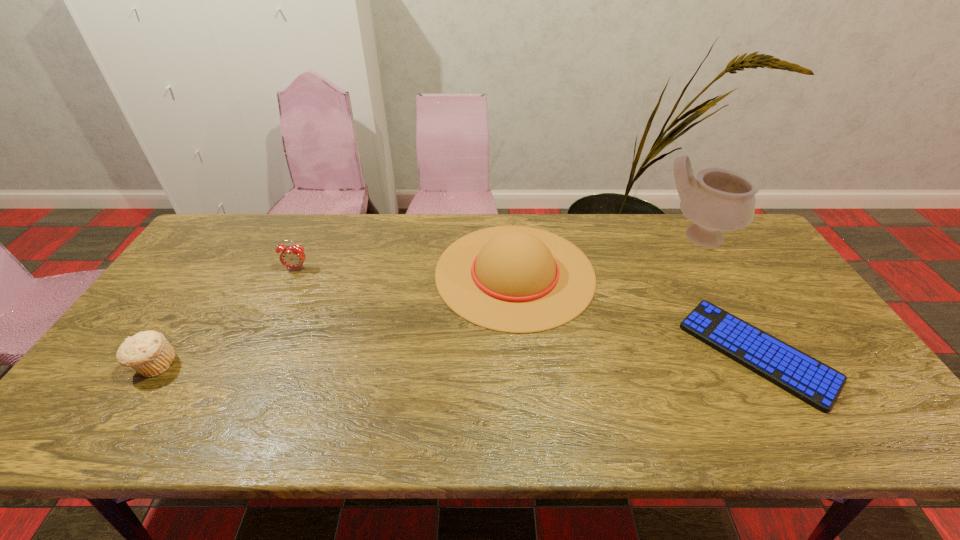
Where is `free space at the left edge of the desktop`? This screenshot has width=960, height=540. free space at the left edge of the desktop is located at coordinates (217, 282).

Find the location of a particular element. This screenshot has height=540, width=960. free spot at the right edge of the desktop is located at coordinates (748, 300).

In the image, there is a desktop. Identify the location of blank space at the far right corner. The width and height of the screenshot is (960, 540). (738, 254).

Locate an element on the screen. This screenshot has width=960, height=540. free space at the near right corner of the desktop is located at coordinates (891, 431).

Locate an element on the screen. vacant area that lies between the leftmost object and the fourth object from right to left is located at coordinates (226, 317).

Identify the location of free space between the alarm clock and the leftmost object. The height and width of the screenshot is (540, 960). (226, 317).

Image resolution: width=960 pixels, height=540 pixels. I want to click on empty space that is in between the third object from left to right and the tallest object, so click(x=606, y=255).

Locate an element on the screen. Image resolution: width=960 pixels, height=540 pixels. empty location between the shortest object and the sombrero is located at coordinates (636, 313).

Identify the location of free area in between the second object from left to right and the muffin. The width and height of the screenshot is (960, 540). (226, 317).

I want to click on free space that is in between the muffin and the tallest object, so click(x=426, y=301).